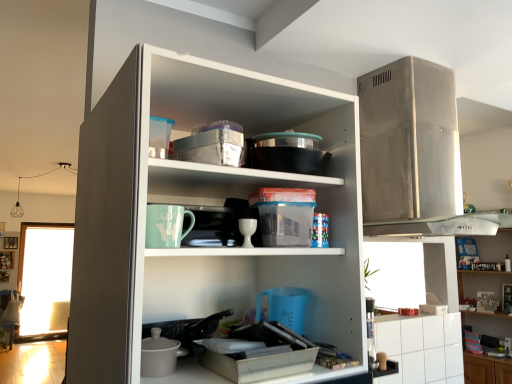
Question: From a real-world perspective, is matte ceramic mug at center, the second appliance from the top, located beneath white glossy cup at center?

Choices:
 (A) yes
 (B) no

Answer: (B)

Question: Does matte ceramic mug at center, which is counted as the 1th appliance, starting from the left, lie behind white glossy cup at center?

Choices:
 (A) no
 (B) yes

Answer: (A)

Question: Is matte ceramic mug at center, placed as the first appliance when sorted from bottom to top, at the right side of white glossy cup at center?

Choices:
 (A) yes
 (B) no

Answer: (B)

Question: Can we say matte ceramic mug at center, the second appliance from the top, lies outside white glossy cup at center?

Choices:
 (A) no
 (B) yes

Answer: (B)

Question: Is matte ceramic mug at center, which is counted as the 1th appliance, starting from the left, next to white glossy cup at center?

Choices:
 (A) no
 (B) yes

Answer: (A)

Question: Is matte ceramic mug at center, which appears as the 2th appliance when viewed from the right, facing towards white glossy cup at center?

Choices:
 (A) yes
 (B) no

Answer: (B)

Question: Does white glossy cabinet at upper right appear on the left side of transparent glass window at left?

Choices:
 (A) yes
 (B) no

Answer: (B)

Question: Could you tell me if white glossy cabinet at upper right is turned towards transparent glass window at left?

Choices:
 (A) no
 (B) yes

Answer: (A)

Question: From the image's perspective, is white glossy cabinet at upper right on top of transparent glass window at left?

Choices:
 (A) no
 (B) yes

Answer: (B)

Question: Is white glossy cabinet at upper right surrounding transparent glass window at left?

Choices:
 (A) no
 (B) yes

Answer: (A)

Question: Considering the relative positions of white glossy cabinet at upper right and transparent glass window at left in the image provided, is white glossy cabinet at upper right to the right of transparent glass window at left from the viewer's perspective?

Choices:
 (A) no
 (B) yes

Answer: (B)

Question: Considering the relative sizes of white glossy cabinet at upper right and transparent glass window at left in the image provided, is white glossy cabinet at upper right taller than transparent glass window at left?

Choices:
 (A) yes
 (B) no

Answer: (B)

Question: From a real-world perspective, is transparent glass window at left over white glossy cabinet at upper right?

Choices:
 (A) no
 (B) yes

Answer: (A)